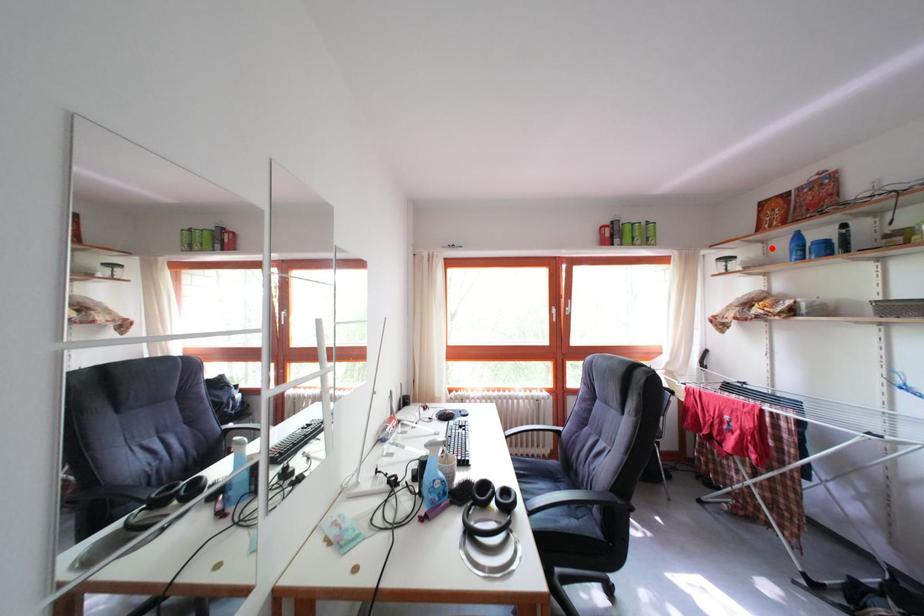
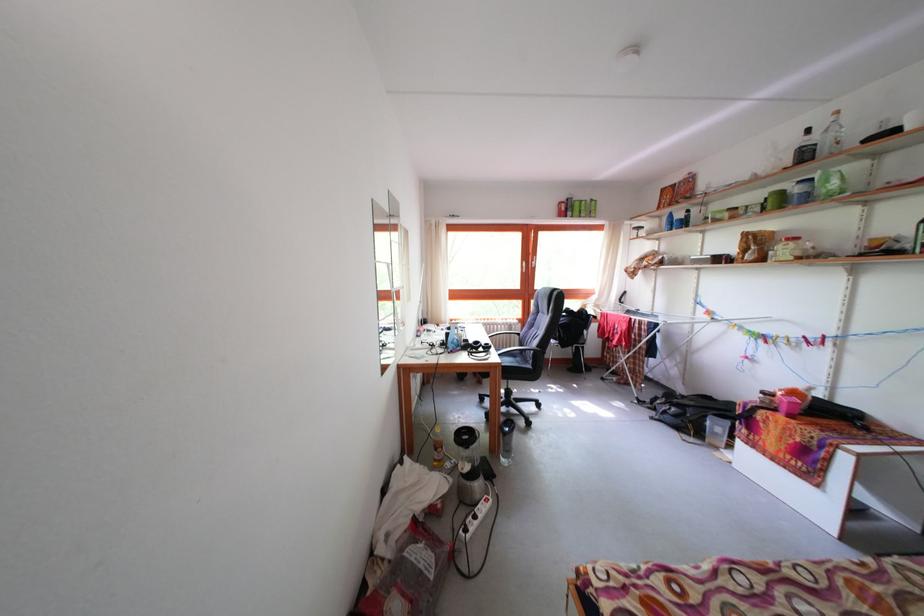
Where in the second image is the point corresponding to the highlighted location from the first image?

(667, 224)